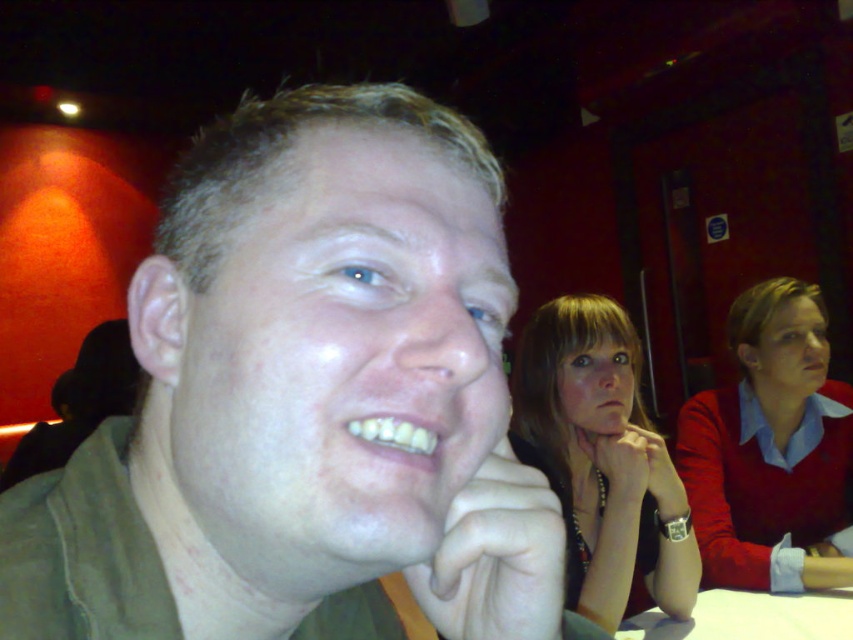
You are standing at the camera position and want to reach point (442, 122). If you can move forward 14 inches, will you be able to reach that point?

Since the distance between point (442, 122) and the camera is 14.25 inches, moving forward 14 inches will get you very close but not exactly to the point. However, you would be within 0.25 inches of the target location.

You are a photographer adjusting your camera settings. You notice the matte red sweater at right and the matte skin at mouth center in your frame. Given that the minimum focus distance for your lens is 7 inches, will both objects remain in focus if you focus on the closer one?

The distance between the matte red sweater at right and the matte skin at mouth center is 7.87 inches. Since the minimum focus distance is 7 inches, focusing on the closer object would keep both within the acceptable focus range as 7.87 inches is just over the minimum requirement.